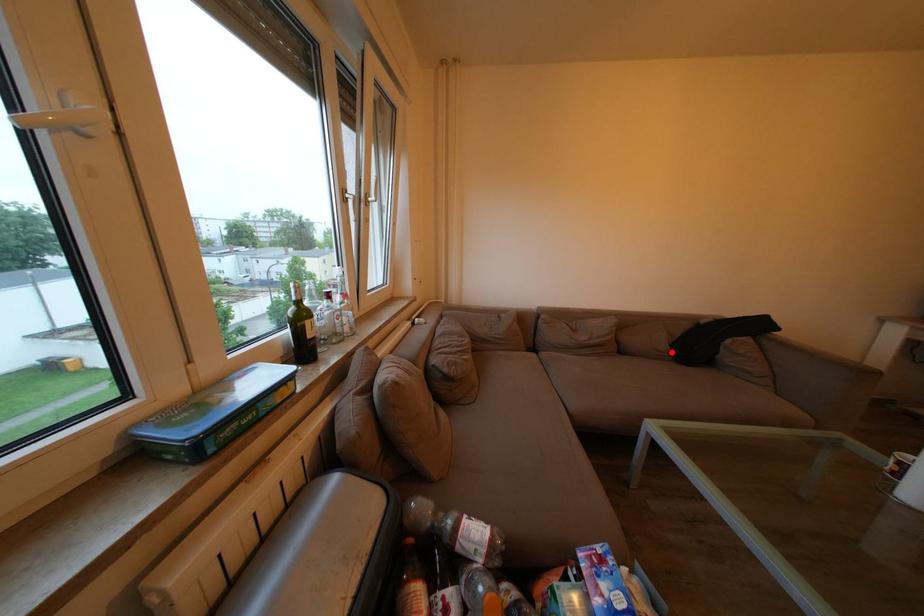
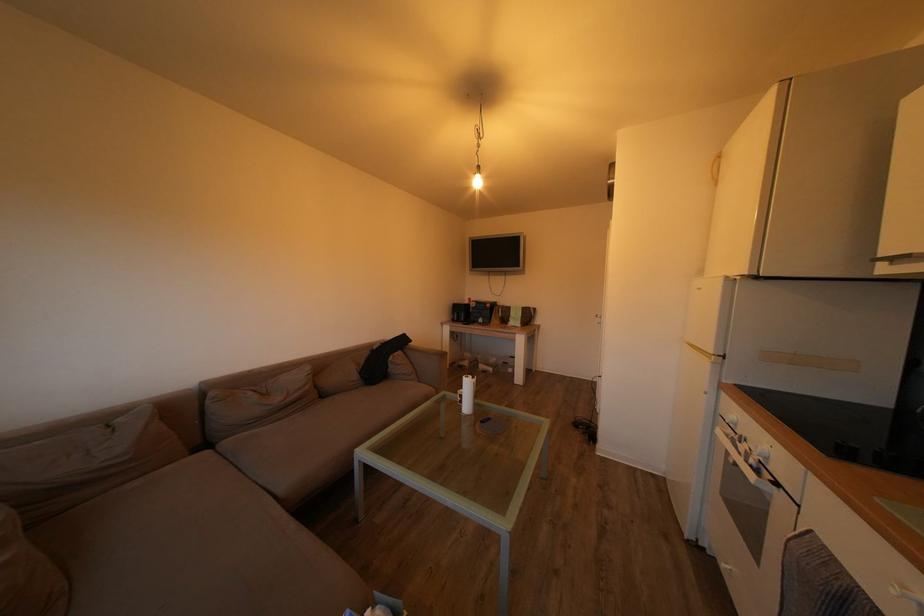
Question: I am providing you with two images of the same scene from different viewpoints. Given a red point in image1, look at the same physical point in image2. Is it:

Choices:
 (A) Closer to the viewpoint
 (B) Farther from the viewpoint

Answer: (B)